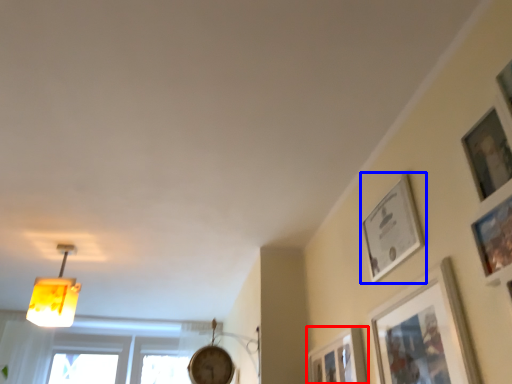
Question: Which object appears closest to the camera in this image, picture frame (highlighted by a red box) or picture frame (highlighted by a blue box)?

Choices:
 (A) picture frame
 (B) picture frame

Answer: (B)